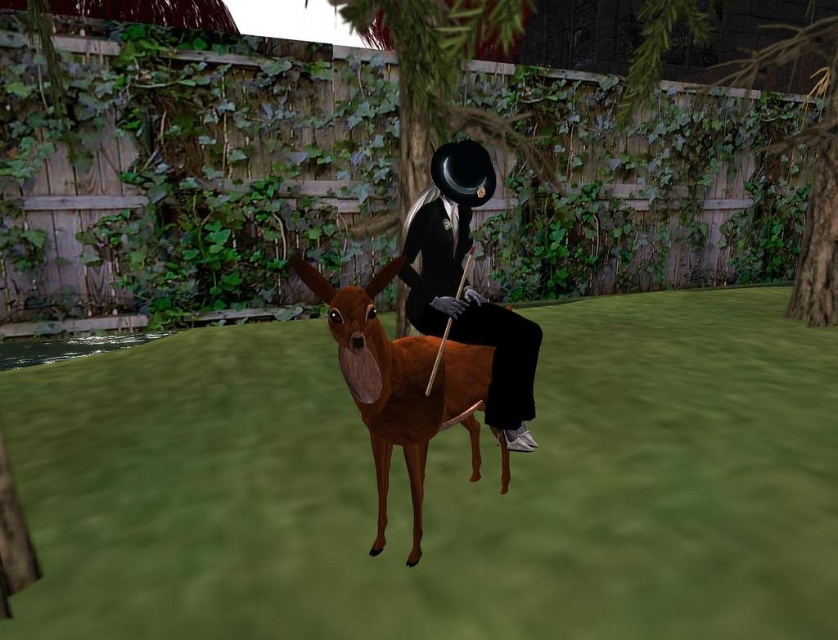
Who is taller, brown matte/deer at center or matte black suit at center?

Standing taller between the two is matte black suit at center.

Is point (440, 342) positioned in front of point (493, 348)?

Yes, it is in front of point (493, 348).

Image resolution: width=838 pixels, height=640 pixels. What do you see at coordinates (401, 385) in the screenshot?
I see `brown matte/deer at center` at bounding box center [401, 385].

I want to click on brown matte/deer at center, so click(401, 385).